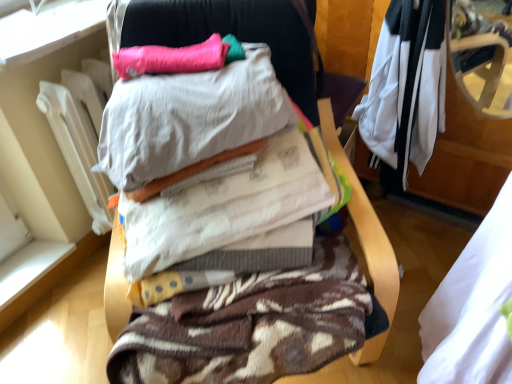
Image resolution: width=512 pixels, height=384 pixels. I want to click on spots to the right of pink fluffy pillow at upper center, which ranks as the first pillow in back-to-front order, so click(241, 70).